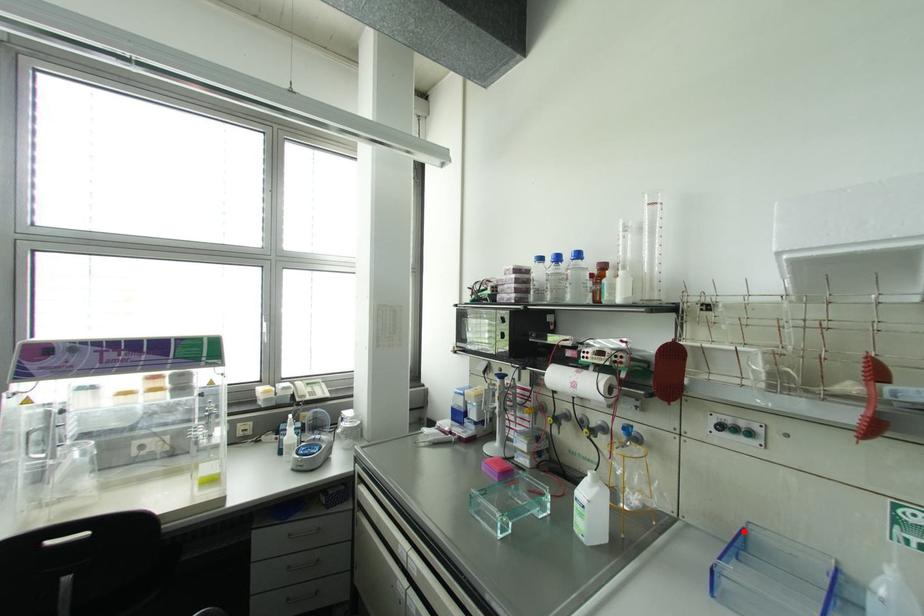
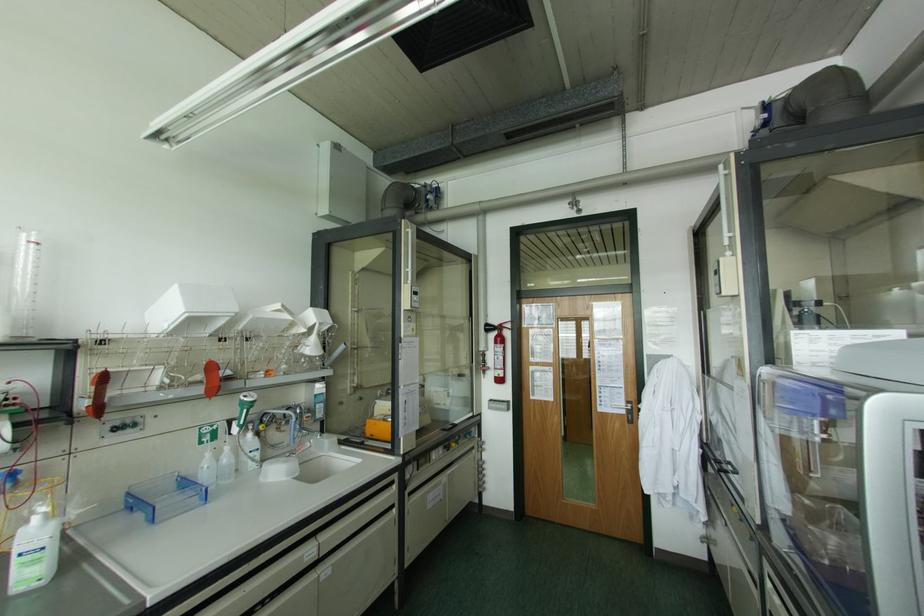
Locate, in the second image, the point that corresponds to the highlighted location in the first image.

(128, 493)